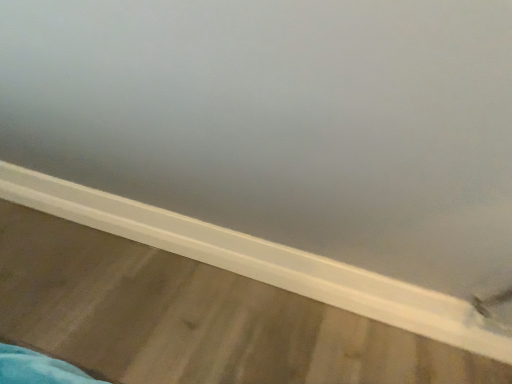
Where is `white wood baseboard at lower center`? Image resolution: width=512 pixels, height=384 pixels. white wood baseboard at lower center is located at coordinates (194, 318).

What do you see at coordinates (194, 318) in the screenshot? I see `white wood baseboard at lower center` at bounding box center [194, 318].

The width and height of the screenshot is (512, 384). I want to click on white wood baseboard at lower center, so click(x=194, y=318).